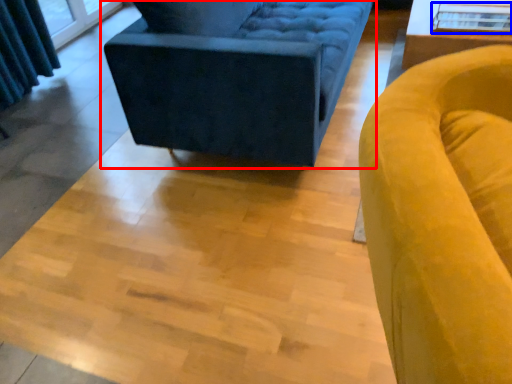
Question: Which object is closer to the camera taking this photo, studio couch (highlighted by a red box) or glass table (highlighted by a blue box)?

Choices:
 (A) studio couch
 (B) glass table

Answer: (A)